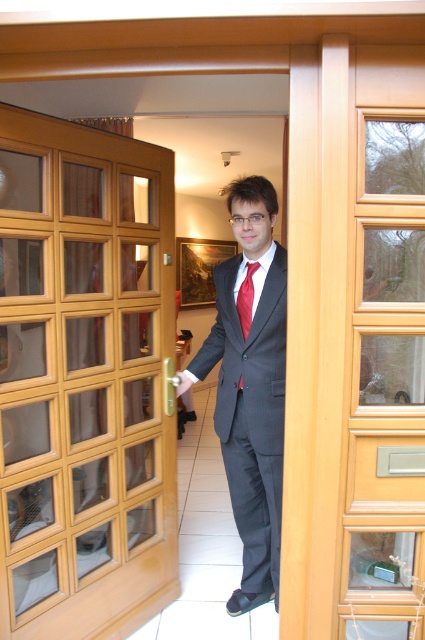
You are a delivery person trying to enter the room through the door. There are two points marked in the image. The first point is at coordinate point (147, 440) and the second point is at coordinate point (204, 352). Which point is closer to the door as you approach from outside?

Point (147, 440) is in front of point (204, 352), so it is closer to the door when approaching from outside.

You are a security camera observing the scene. The wooden glass at left and the red satin tie at center are both visible in your field of view. Which object is closer to the camera?

The wooden glass at left is closer to the camera because it is in front of the red satin tie at center.

You are a fashion designer observing a person dressed in a dark gray suit at center and a red satin tie at center. Which clothing item is positioned lower on the person?

The dark gray suit at center is positioned below the red satin tie at center, so the dark gray suit at center is lower.